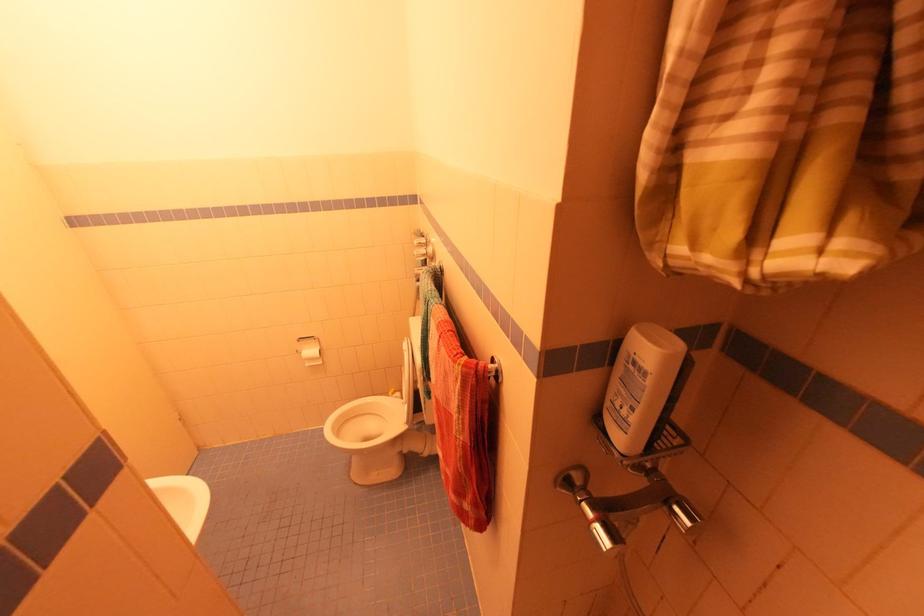
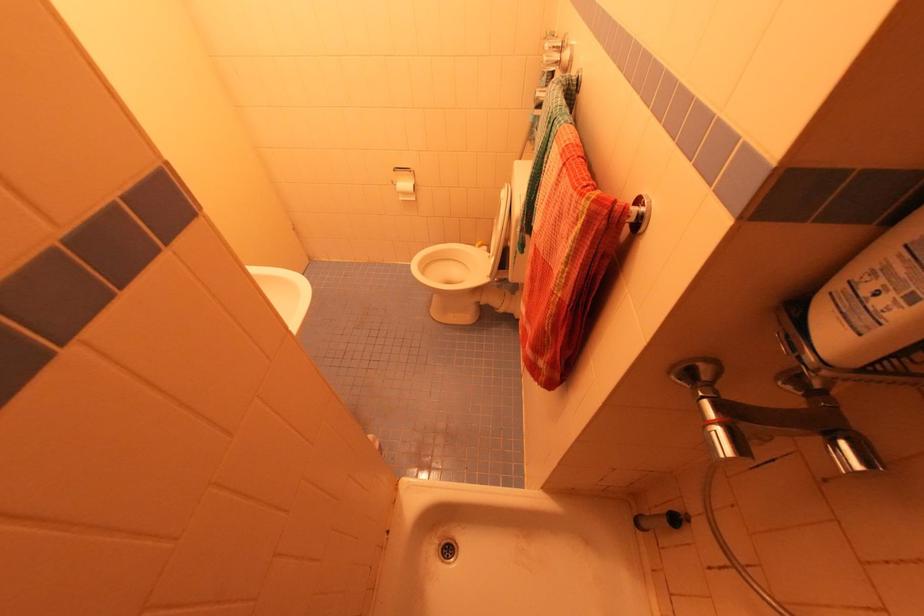
Locate, in the second image, the point that corresponds to point (626, 413) in the first image.

(881, 302)